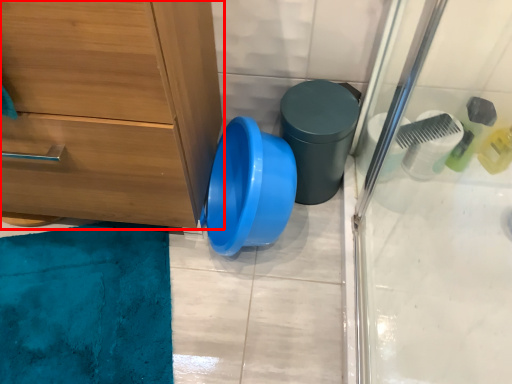
Question: Where is chest of drawers (annotated by the red box) located in relation to potty in the image?

Choices:
 (A) right
 (B) left

Answer: (B)